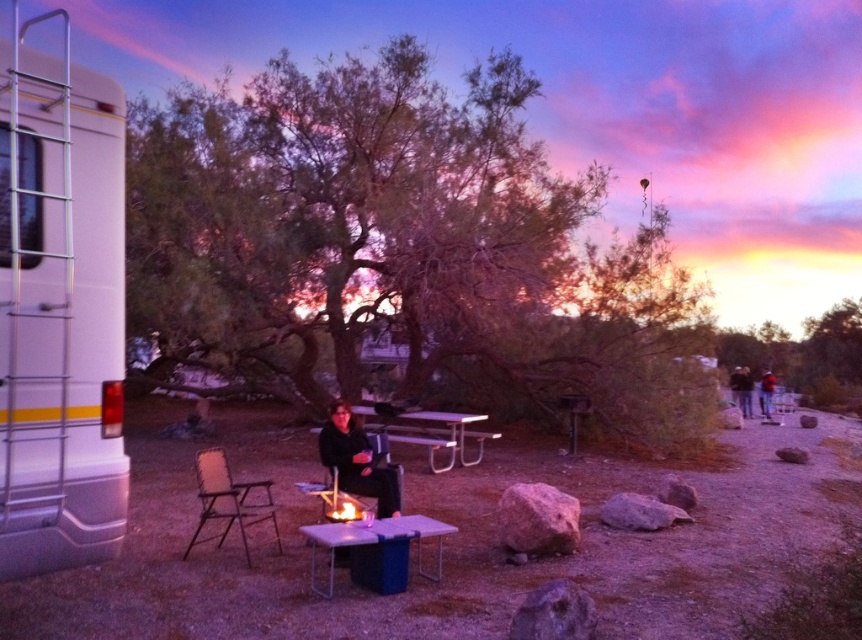
Is point (30, 262) farther from viewer compared to point (315, 548)?

No, it is in front of (315, 548).

Between point (119, 506) and point (363, 536), which one is positioned in front?

Point (119, 506) is in front.

The image size is (862, 640). Find the location of `white metallic recreational vehicle at left`. white metallic recreational vehicle at left is located at coordinates (59, 308).

Between white metallic recreational vehicle at left and black fabric jacket at center, which one has more height?

white metallic recreational vehicle at left is taller.

Can you confirm if white metallic recreational vehicle at left is bigger than black fabric jacket at center?

Correct, white metallic recreational vehicle at left is larger in size than black fabric jacket at center.

Locate an element on the screen. This screenshot has height=640, width=862. white metallic recreational vehicle at left is located at coordinates (59, 308).

Is green leafy tree at center closer to the viewer compared to black fabric jacket at center?

No, green leafy tree at center is behind black fabric jacket at center.

The width and height of the screenshot is (862, 640). What are the coordinates of `green leafy tree at center` in the screenshot? It's located at (401, 248).

Between point (186, 246) and point (351, 428), which one is positioned behind?

The point (186, 246) is more distant.

Image resolution: width=862 pixels, height=640 pixels. What are the coordinates of `green leafy tree at center` in the screenshot? It's located at (401, 248).